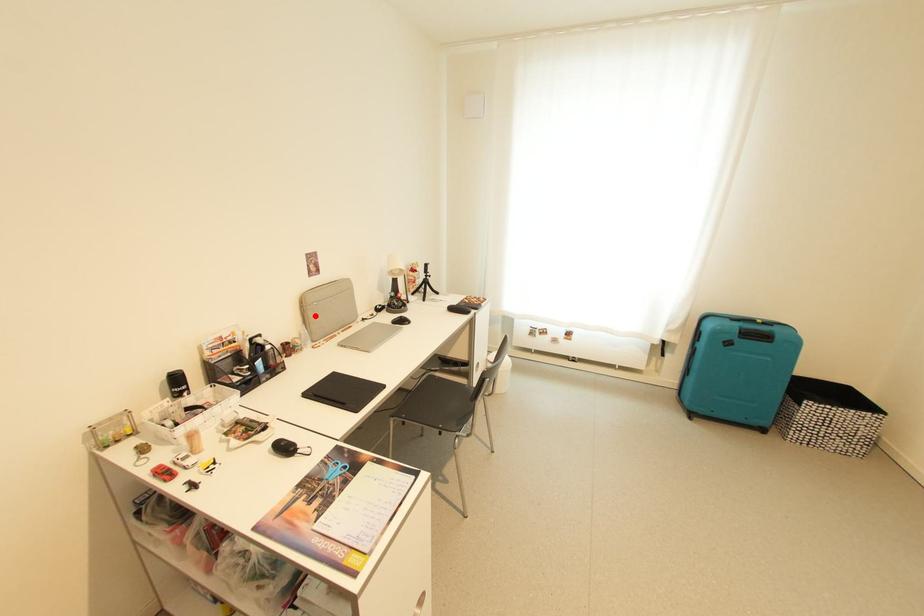
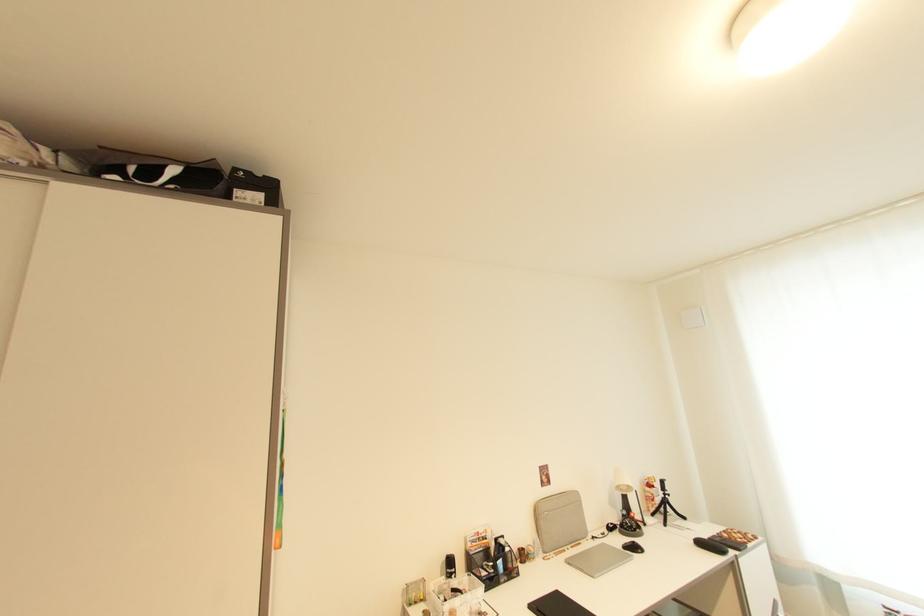
Question: I am providing you with two images of the same scene from different viewpoints. A red point is marked on the first image. At the location where the point appears in image 1, is it still visible in image 2?

Choices:
 (A) Yes
 (B) No

Answer: (A)